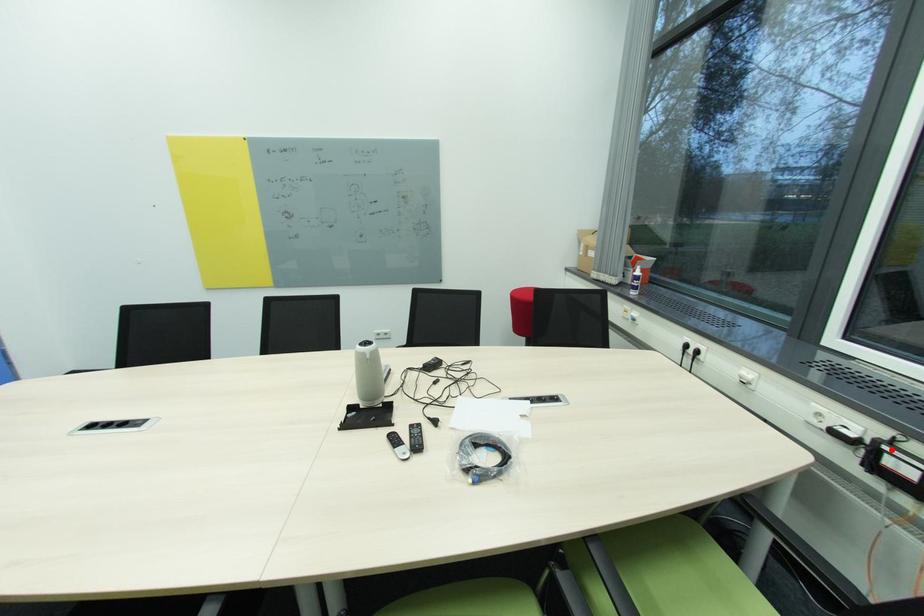
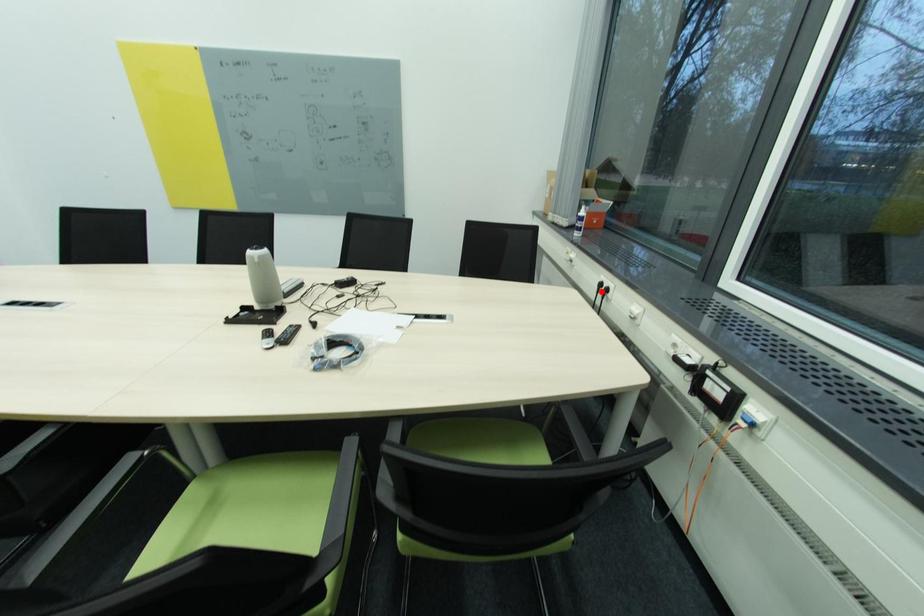
I am providing you with two images of the same scene from different viewpoints. A red point is marked on the first image and another point is marked on the second image. Are the points marked in image1 and image2 representing the same 3D position?

No